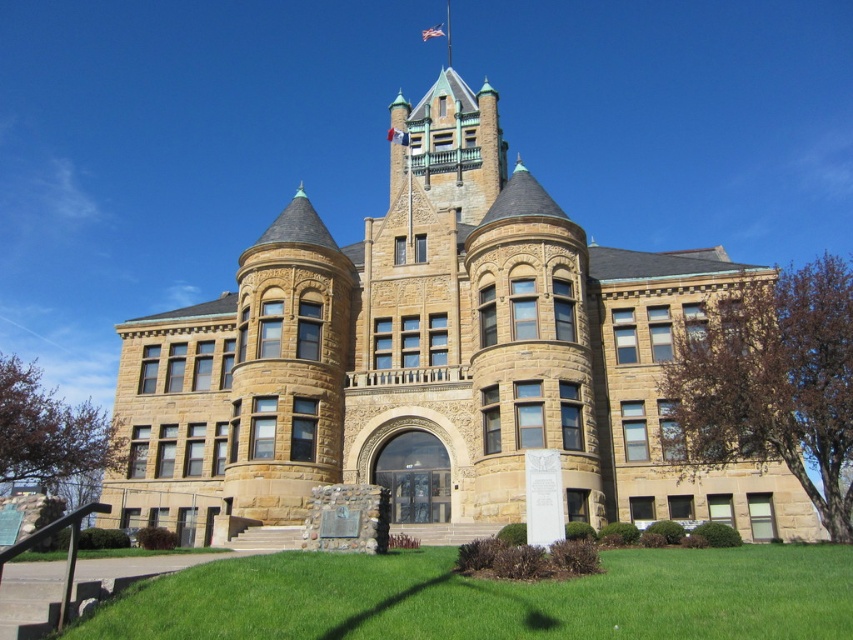
You are standing in front of the grand historic stone building. If you want to take a photo of the brown stone tower at center, where should you position yourself relative to the building to ensure it is centered in your camera frame?

To center the brown stone tower at center in your camera frame, position yourself directly in front of the building at the midpoint horizontally and slightly below the midpoint vertically, as its 2D coordinates are at approximately 0.561 on the x and 0.504 on the y axis.

You are standing in front of the grand stone building. There is a point marked at coordinates (428, 358). Which object is located at this point?

The brown stone tower at center is located at point (428, 358).